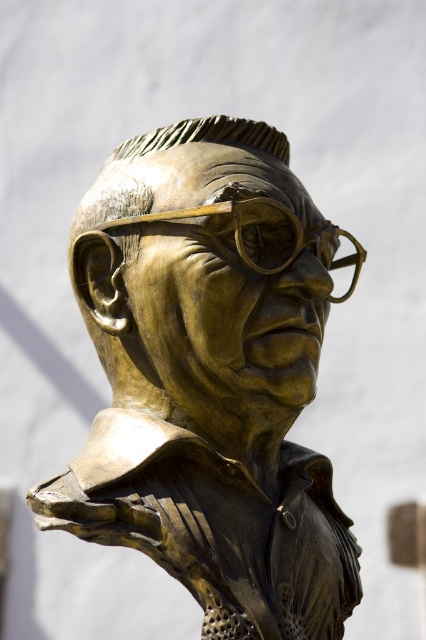
You are an art conservator assessing the space requirements for transporting the bronze statue at center and the gold textured goggles at center. Which object requires more horizontal space for storage?

The bronze statue at center requires more horizontal space for storage since its width surpasses that of the gold textured goggles at center.

You are a photographer taking a closeup shot of the bronze bust sculpture. You notice two points on the sculpture marked at coordinates point (150, 380) and point (293, 253). Which point is closer to your camera lens?

Point (150, 380) is further to the camera than point (293, 253), so the point closer to the camera lens is point (293, 253).